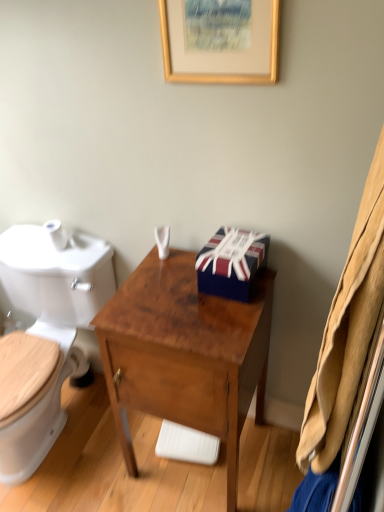
At what (x,y) coordinates should I click in order to perform the action: click on vacant space positioned to the left of union jack-patterned gift box at center. Please return your answer as a coordinate pair (x, y). The width and height of the screenshot is (384, 512). Looking at the image, I should click on (175, 290).